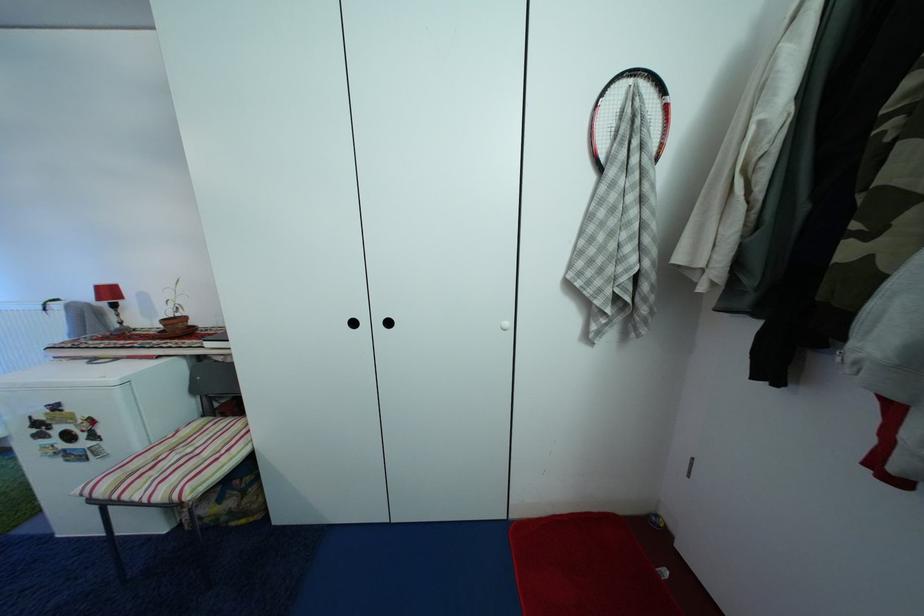
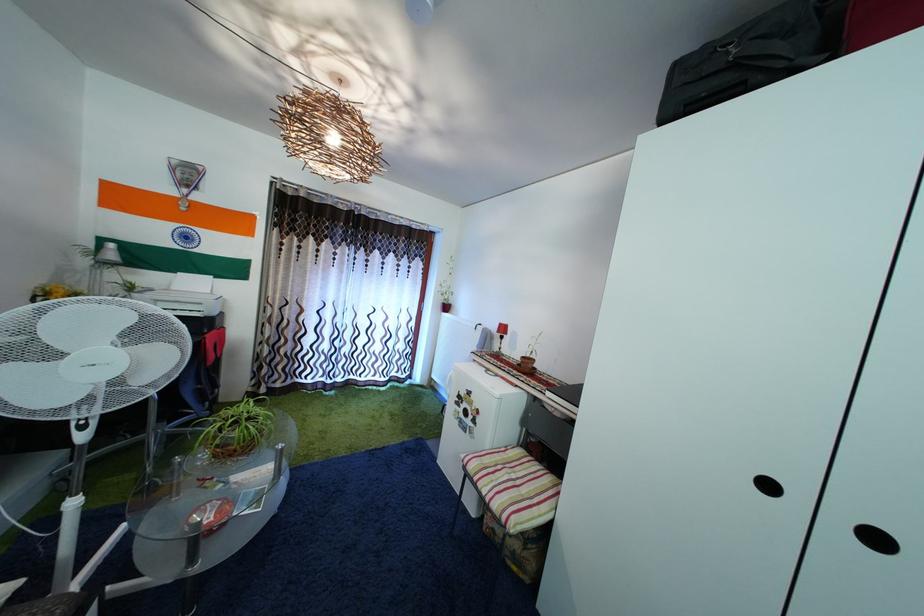
Question: The images are taken continuously from a first-person perspective. In which direction is your viewpoint rotating?

Choices:
 (A) Left
 (B) Right
 (C) Up
 (D) Down

Answer: (A)